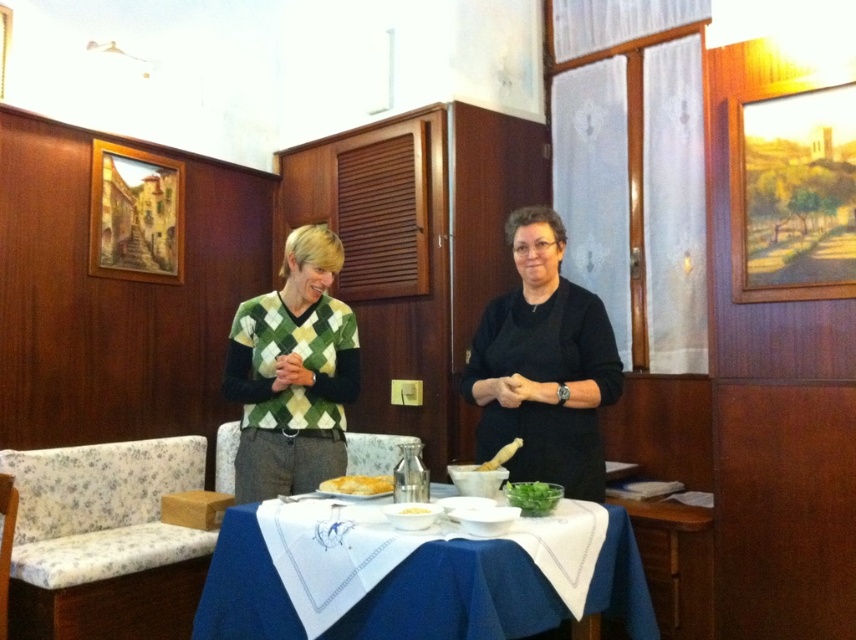
Which of these two, black matte dress at center or green leafy vegetable at center, stands taller?

black matte dress at center is taller.

Does black matte dress at center appear under green leafy vegetable at center?

No.

Image resolution: width=856 pixels, height=640 pixels. Describe the element at coordinates (544, 365) in the screenshot. I see `black matte dress at center` at that location.

Locate an element on the screen. black matte dress at center is located at coordinates (544, 365).

What do you see at coordinates (357, 484) in the screenshot? This screenshot has width=856, height=640. I see `golden crispy bread at center` at bounding box center [357, 484].

Can you confirm if golden crispy bread at center is positioned to the left of white matte bowl at center?

Yes, golden crispy bread at center is to the left of white matte bowl at center.

Find the location of a particular element. Image resolution: width=856 pixels, height=640 pixels. golden crispy bread at center is located at coordinates (357, 484).

This screenshot has height=640, width=856. In order to click on golden crispy bread at center in this screenshot , I will do `click(357, 484)`.

Between black matte dress at center and green argyle sweater at center, which one is positioned higher?

black matte dress at center is higher up.

Between black matte dress at center and green argyle sweater at center, which one appears on the right side from the viewer's perspective?

From the viewer's perspective, black matte dress at center appears more on the right side.

Describe the element at coordinates (544, 365) in the screenshot. The image size is (856, 640). I see `black matte dress at center` at that location.

Locate an element on the screen. This screenshot has width=856, height=640. black matte dress at center is located at coordinates (544, 365).